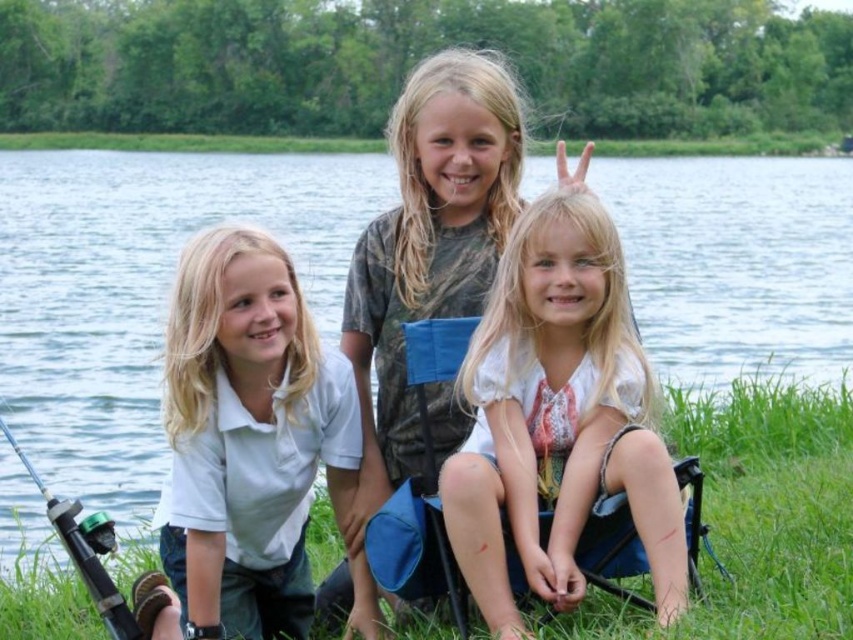
Is clear blue water at center bigger than green plastic fishing pole at lower left?

Yes, clear blue water at center is bigger than green plastic fishing pole at lower left.

Is point (146, 152) farther from viewer compared to point (107, 627)?

That is True.

Is point (276, 184) positioned after point (115, 632)?

Yes, it is.

Find the location of a particular element. The width and height of the screenshot is (853, 640). clear blue water at center is located at coordinates (141, 291).

Between white lace shirt at center and green grass at lower center, which one is positioned lower?

green grass at lower center is lower down.

Between point (531, 340) and point (589, 605), which one is positioned behind?

The point (531, 340) is behind.

Locate an element on the screen. This screenshot has width=853, height=640. white lace shirt at center is located at coordinates (558, 419).

Can you confirm if white cotton shirt at left is shorter than green plastic fishing pole at lower left?

No, white cotton shirt at left is not shorter than green plastic fishing pole at lower left.

Can you confirm if white cotton shirt at left is taller than green plastic fishing pole at lower left?

Correct, white cotton shirt at left is much taller as green plastic fishing pole at lower left.

Is point (233, 310) positioned after point (16, 456)?

That is False.

Locate an element on the screen. This screenshot has height=640, width=853. white cotton shirt at left is located at coordinates pyautogui.click(x=248, y=436).